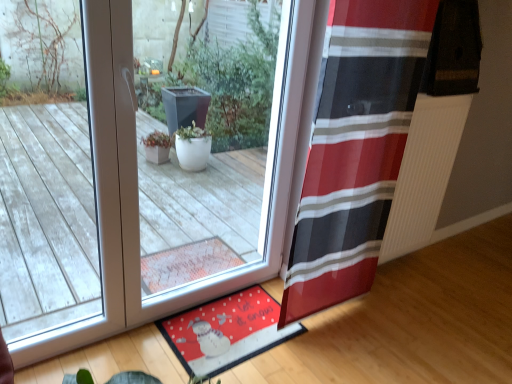
Question: Does red fabric mat at lower center have a greater width compared to transparent glass window at center?

Choices:
 (A) no
 (B) yes

Answer: (B)

Question: Considering the relative sizes of red fabric mat at lower center and transparent glass window at center in the image provided, is red fabric mat at lower center shorter than transparent glass window at center?

Choices:
 (A) yes
 (B) no

Answer: (A)

Question: Is red fabric mat at lower center positioned before transparent glass window at center?

Choices:
 (A) yes
 (B) no

Answer: (B)

Question: From the image's perspective, is red fabric mat at lower center over transparent glass window at center?

Choices:
 (A) no
 (B) yes

Answer: (A)

Question: Does red fabric mat at lower center lie behind transparent glass window at center?

Choices:
 (A) no
 (B) yes

Answer: (B)

Question: From their relative heights in the image, would you say red fabric mat at lower center is taller or shorter than transparent glass window at center?

Choices:
 (A) tall
 (B) short

Answer: (B)

Question: Looking at their shapes, would you say red fabric mat at lower center is wider or thinner than transparent glass window at center?

Choices:
 (A) thin
 (B) wide

Answer: (B)

Question: Relative to transparent glass window at center, is red fabric mat at lower center in front or behind?

Choices:
 (A) front
 (B) behind

Answer: (B)

Question: From a real-world perspective, relative to transparent glass window at center, is red fabric mat at lower center vertically above or below?

Choices:
 (A) below
 (B) above

Answer: (A)

Question: Looking at their shapes, would you say red striped curtain at right is wider or thinner than red fabric mat at lower center?

Choices:
 (A) thin
 (B) wide

Answer: (A)

Question: From the image's perspective, relative to red fabric mat at lower center, is red striped curtain at right above or below?

Choices:
 (A) below
 (B) above

Answer: (B)

Question: Based on their sizes in the image, would you say red striped curtain at right is bigger or smaller than red fabric mat at lower center?

Choices:
 (A) small
 (B) big

Answer: (B)

Question: From a real-world perspective, relative to red fabric mat at lower center, is red striped curtain at right vertically above or below?

Choices:
 (A) below
 (B) above

Answer: (B)

Question: From a real-world perspective, is transparent glass window at center above or below red striped curtain at right?

Choices:
 (A) above
 (B) below

Answer: (B)

Question: Is transparent glass window at center in front of or behind red striped curtain at right in the image?

Choices:
 (A) front
 (B) behind

Answer: (A)